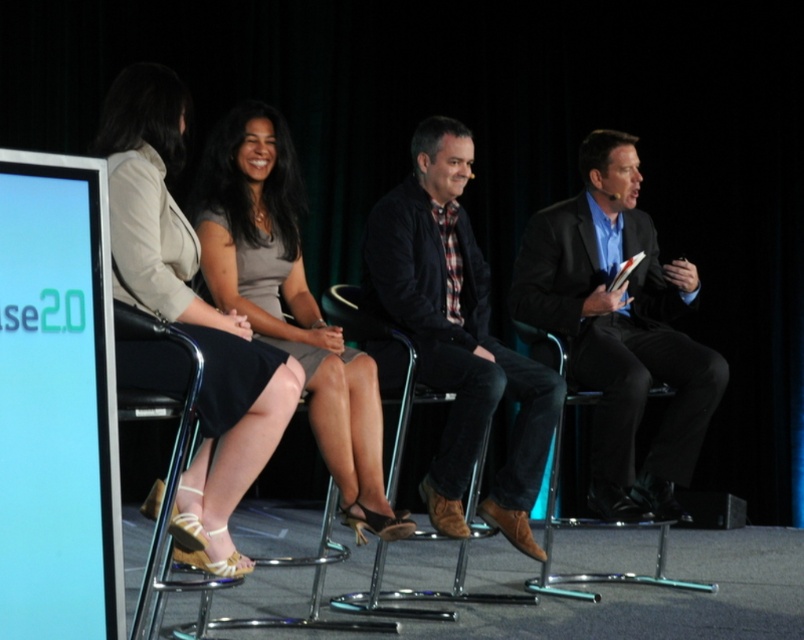
Between dark brown leather jacket at center and metallic chrome chair at right, which one has less height?

With less height is metallic chrome chair at right.

Is dark brown leather jacket at center above metallic chrome chair at right?

Yes, dark brown leather jacket at center is above metallic chrome chair at right.

In the scene shown: Who is more distant from viewer, (560,384) or (580,392)?

The point (580,392) is more distant.

At what (x,y) coordinates should I click in order to perform the action: click on dark brown leather jacket at center. Please return your answer as a coordinate pair (x, y). This screenshot has width=804, height=640. Looking at the image, I should click on (457, 336).

What do you see at coordinates (189, 314) in the screenshot?
I see `matte beige dress at center` at bounding box center [189, 314].

How far apart are matte beige dress at center and dark brown leather jacket at center?

matte beige dress at center is 1.08 meters from dark brown leather jacket at center.

What do you see at coordinates (189, 314) in the screenshot? I see `matte beige dress at center` at bounding box center [189, 314].

Identify the location of matte beige dress at center. (189, 314).

Can you confirm if dark brown leather jacket at center is wider than matte gray dress at center?

Yes, dark brown leather jacket at center is wider than matte gray dress at center.

Is dark brown leather jacket at center closer to the viewer compared to matte gray dress at center?

No.

Where is `dark brown leather jacket at center`? Image resolution: width=804 pixels, height=640 pixels. dark brown leather jacket at center is located at coordinates (457, 336).